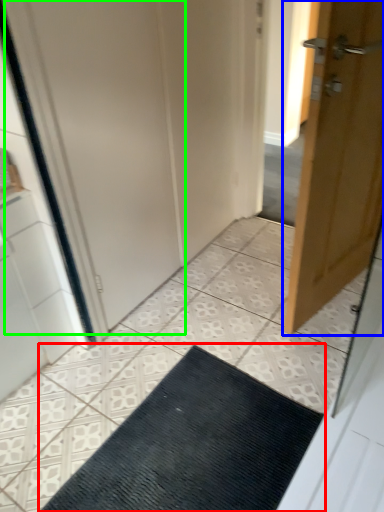
Question: Which object is positioned farthest from doormat (highlighted by a red box)? Select from door (highlighted by a blue box) and screen door (highlighted by a green box).

Choices:
 (A) door
 (B) screen door

Answer: (B)